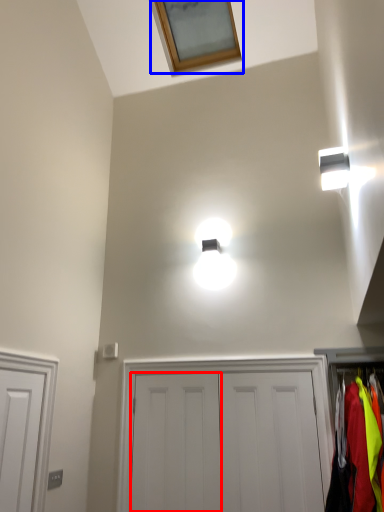
Question: Which of the following is the closest to the observer, door (highlighted by a red box) or window (highlighted by a blue box)?

Choices:
 (A) door
 (B) window

Answer: (A)